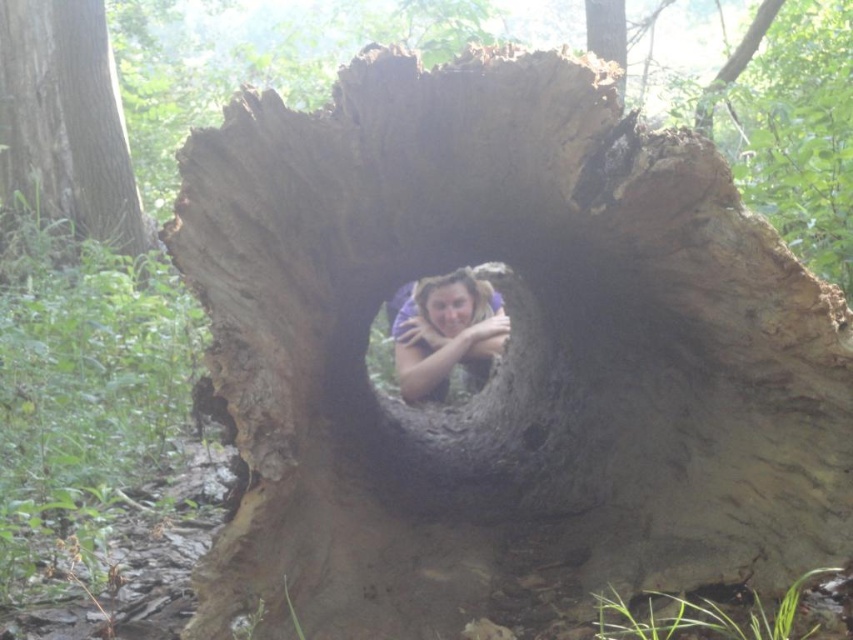
You are a photographer trying to capture the smooth brown tree trunk at center and the matte purple shirt at center in a single shot. Which object should you focus on first to ensure both are in focus?

You should focus on the smooth brown tree trunk at center first because it is closer to you than the matte purple shirt at center, so focusing on the closer object ensures both will be in focus.

You are a hiker who wants to hide behind the smooth brown tree trunk at center while keeping an eye on the matte purple shirt at center. Is the trunk large enough to fully conceal your body?

The smooth brown tree trunk at center is bigger than the matte purple shirt at center, so yes, the trunk is large enough to fully conceal your body.

You are a photographer trying to capture the smooth brown tree trunk at center and the matte purple shirt at center in the same frame. Based on their positions, which object should you adjust your camera angle to focus on first to ensure both are in the frame?

The smooth brown tree trunk at center is above the matte purple shirt at center, so you should focus on the smooth brown tree trunk at center first to ensure both are in the frame.